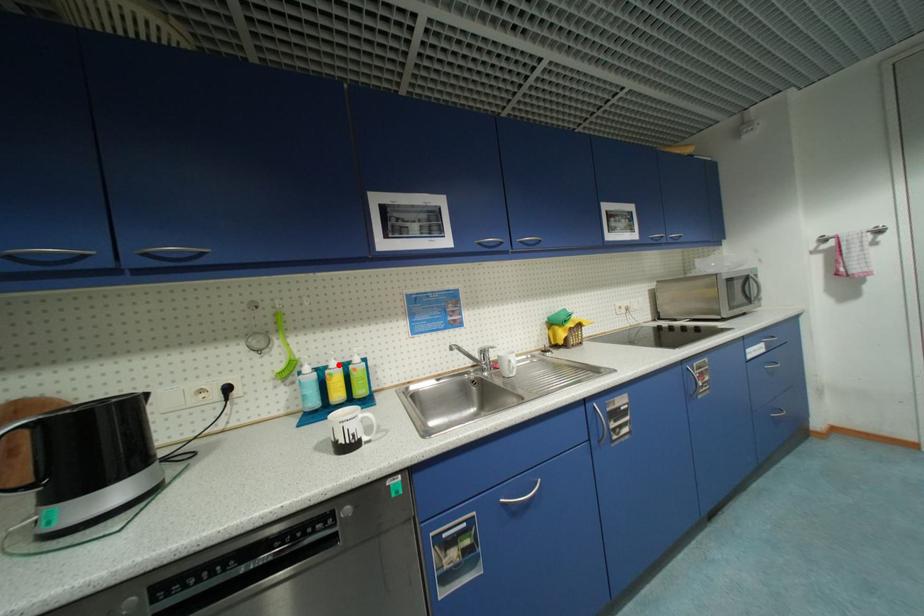
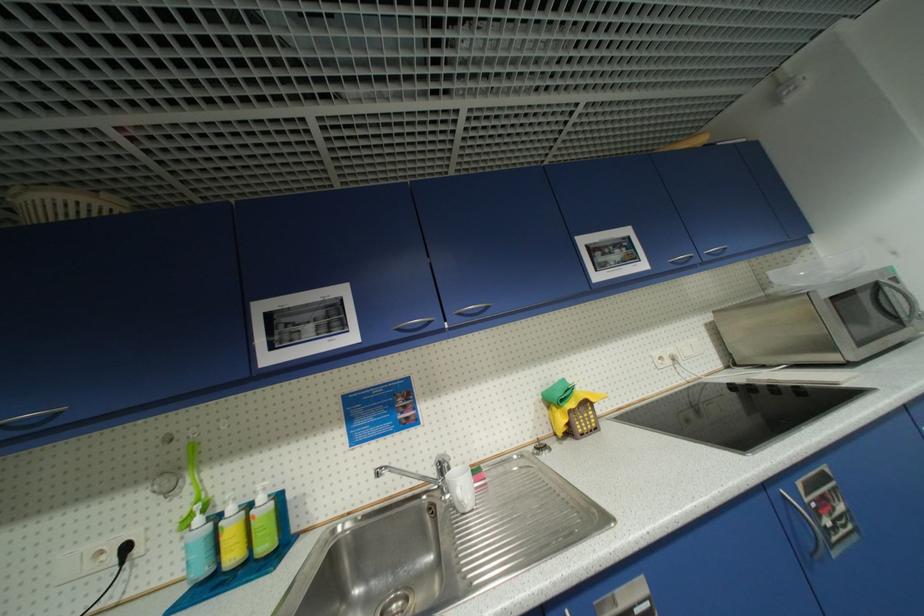
Find the pixel in the second image that matches the highlighted location in the first image.

(237, 511)